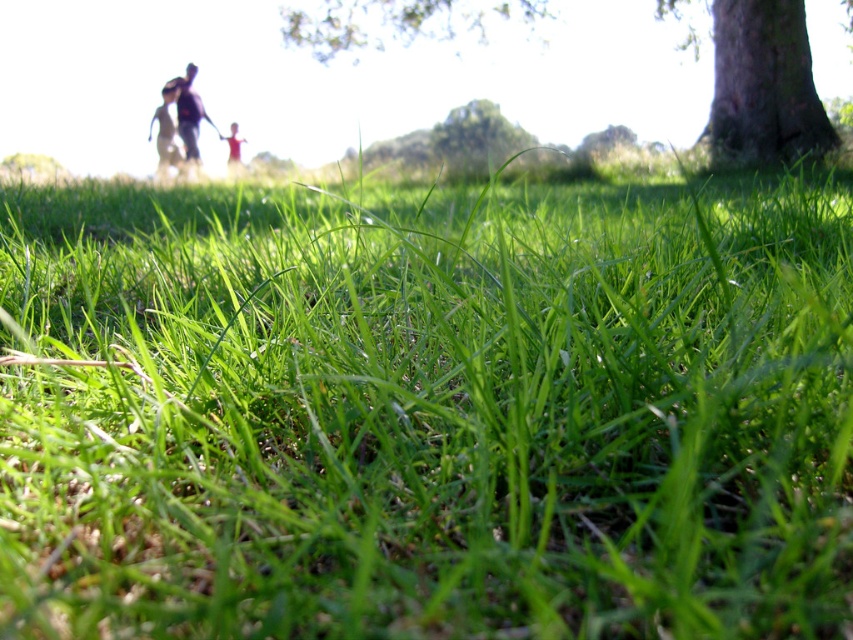
You are a photographer trying to capture the smooth bark tree at upper right and the dark blue shirt at upper center in your shot. Which object should you focus on if you want to emphasize the height difference between them?

The smooth bark tree at upper right is taller than the dark blue shirt at upper center, so focusing on the smooth bark tree at upper right would emphasize its greater height compared to the dark blue shirt at upper center.

You are standing in the outdoor scene and want to take a photo of the dark gray figure at upper left without the green rough bark tree at right blocking the view. Is this possible?

The green rough bark tree at right is closer to the viewer than the dark gray figure at upper left, so the tree would block the view of the dark gray figure at upper left. Therefore, it is not possible to take a photo of the dark gray figure at upper left without the tree blocking the view.

You are standing in the outdoor scene and want to take a photo of the dark blue shirt at upper center. However, there is a smooth bark tree at upper right blocking your view. Can you move to your left or right to avoid the tree?

The smooth bark tree at upper right is to the right of the dark blue shirt at upper center. To avoid the tree, you should move to your left to position yourself where the tree is no longer obstructing the view of the dark blue shirt at upper center.